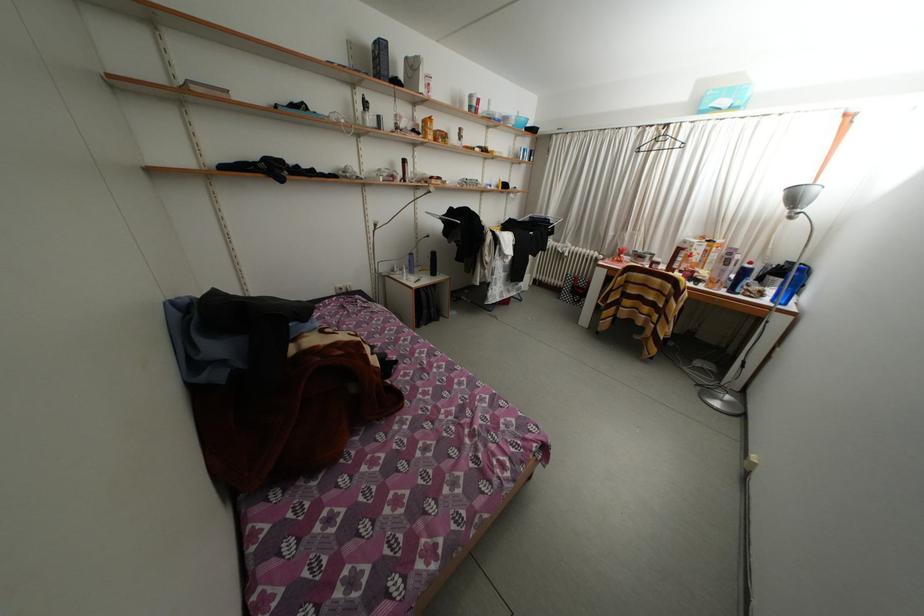
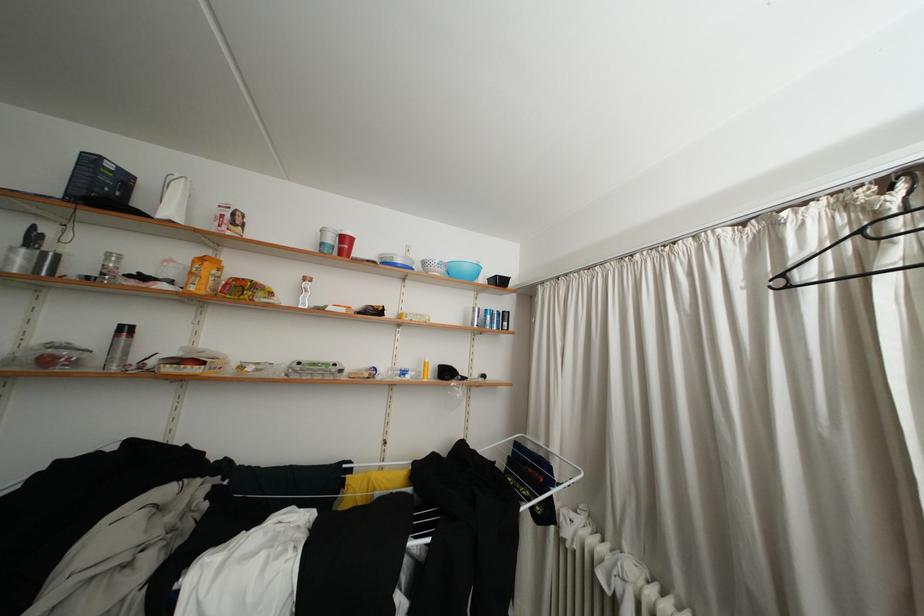
Where in the second image is the point corresponding to point 482,108 from the first image?

(338, 245)